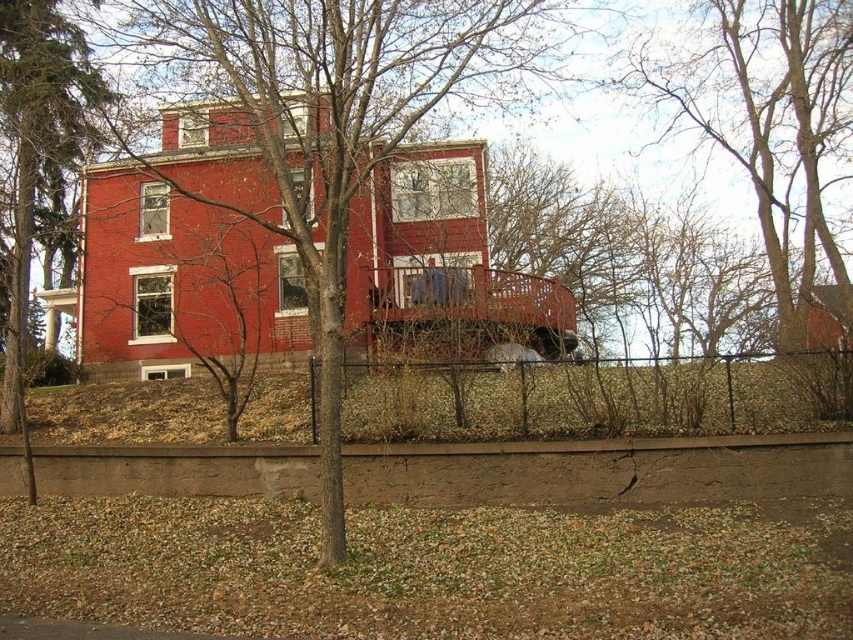
Can you confirm if bare branches at center is shorter than bare branches at upper center?

Indeed, bare branches at center has a lesser height compared to bare branches at upper center.

Does bare branches at center lie in front of bare branches at upper center?

Yes, bare branches at center is closer to the viewer.

Who is more forward, (456, 3) or (805, 188)?

Positioned in front is point (456, 3).

Locate an element on the screen. bare branches at center is located at coordinates (334, 122).

Consider the image. Can you confirm if black metal fence at lower center is positioned above bare branches at upper center?

No, black metal fence at lower center is not above bare branches at upper center.

Is point (839, 378) positioned before point (703, 128)?

Yes, it is.

Who is more forward, (399,408) or (732,35)?

Point (399,408) is in front.

Find the location of a particular element. The height and width of the screenshot is (640, 853). black metal fence at lower center is located at coordinates (595, 397).

In order to click on bare branches at center in this screenshot , I will do `click(334, 122)`.

Does point (341, 268) come closer to viewer compared to point (721, 401)?

No, (341, 268) is further to viewer.

Which is in front, point (519, 42) or point (734, 394)?

Point (519, 42)

Find the location of a particular element. The height and width of the screenshot is (640, 853). bare branches at center is located at coordinates [x=334, y=122].